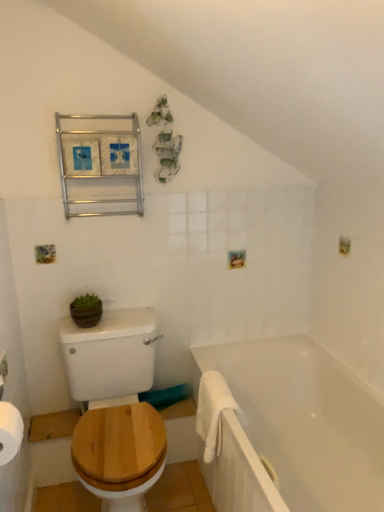
Find the location of a particular element. free space to the right of green matte pot at center is located at coordinates (127, 315).